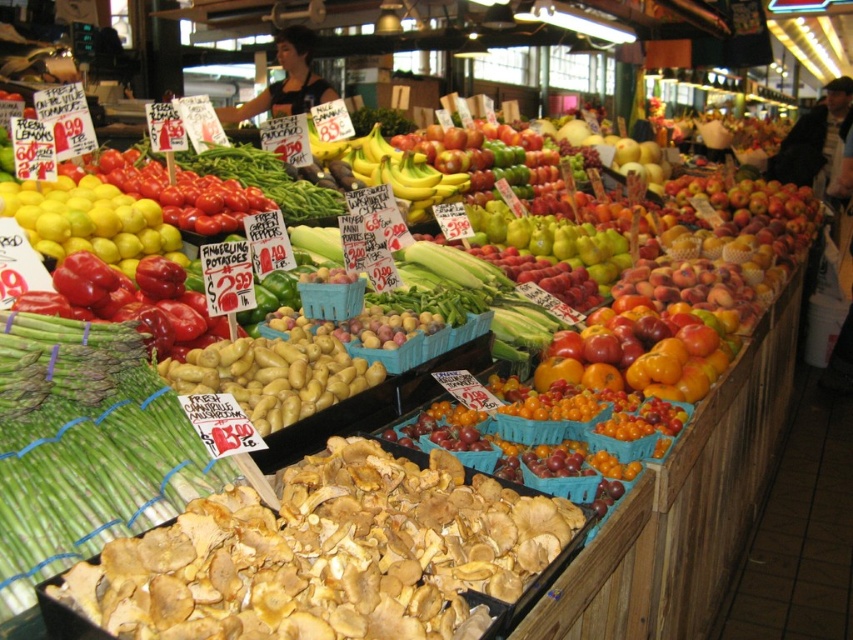
Does green asparagus at left have a greater width compared to matte yellow lemons at left?

No, green asparagus at left is not wider than matte yellow lemons at left.

Which is in front, point (61, 536) or point (28, 198)?

Point (61, 536)

Who is more distant from viewer, (7,596) or (67,220)?

The point (67,220) is more distant.

Where is `green asparagus at left`? The height and width of the screenshot is (640, 853). green asparagus at left is located at coordinates (85, 448).